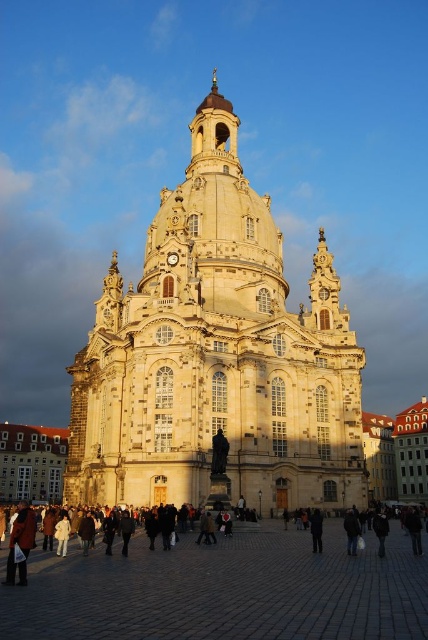
You are a photographer standing in the plaza in front of the historic church. You see a leather jacket at lower left and a black leather jacket at lower right. Which jacket appears taller in the photo?

The leather jacket at lower left appears taller than the black leather jacket at lower right in the photo.

You are standing in the plaza in front of the historic church and notice a leather jacket at lower left. Based on its position, can you estimate how close it is to the edge of the plaza?

The leather jacket at lower left is located at point (20, 544), which means it is very close to the edge of the plaza since its coordinates are near the lower left corner.